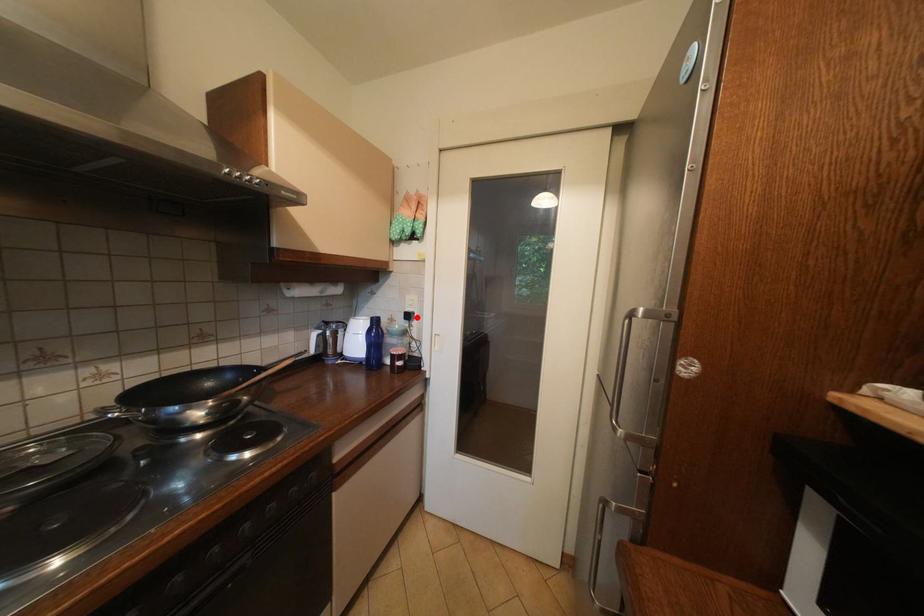
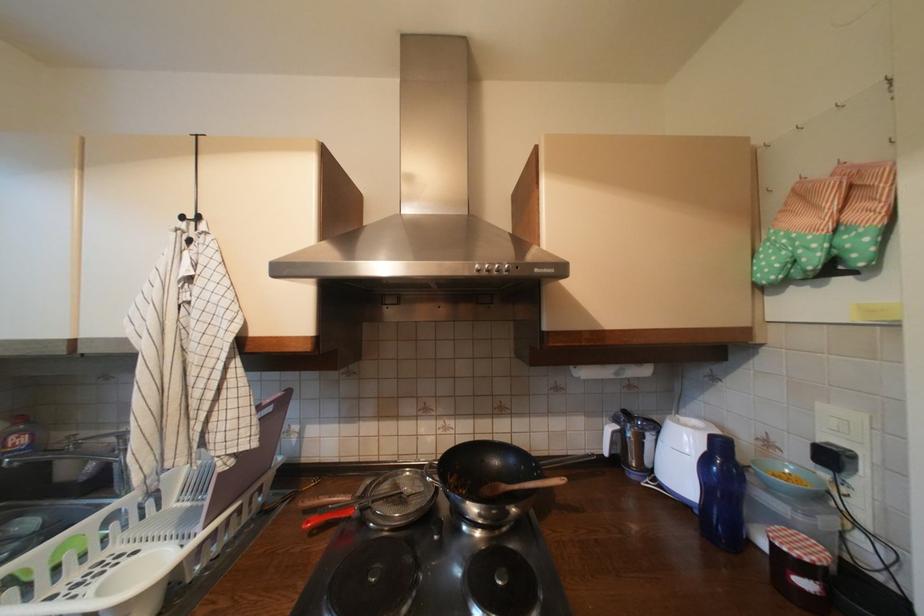
The point at the highlighted location is marked in the first image. Where is the corresponding point in the second image?

(840, 459)